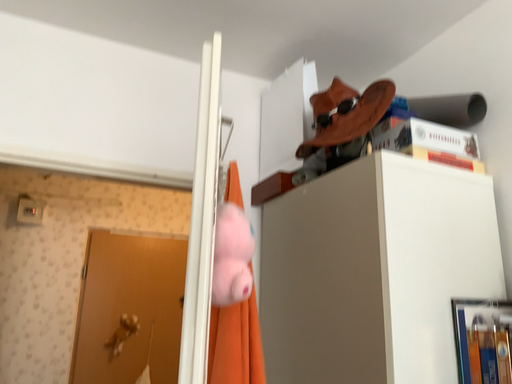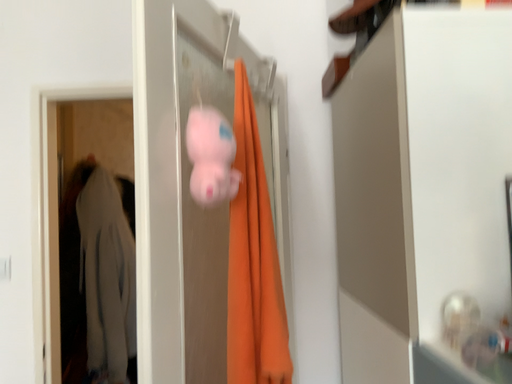
Question: Which way did the camera rotate in the video?

Choices:
 (A) rotated right
 (B) rotated left

Answer: (B)